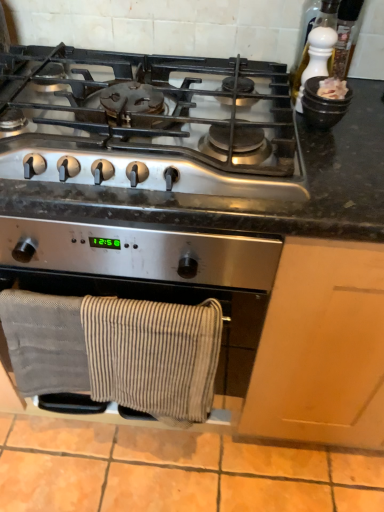
Where is `spots to the right of white ceramic pepper grinder at upper right`? This screenshot has width=384, height=512. spots to the right of white ceramic pepper grinder at upper right is located at coordinates (364, 111).